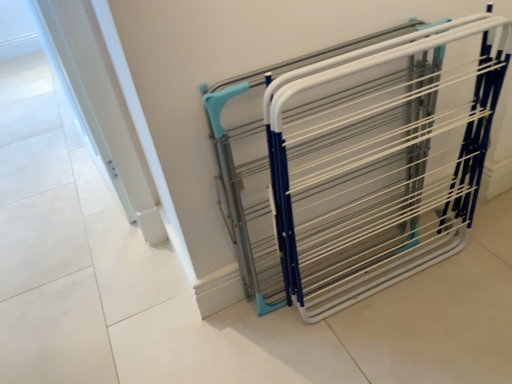
Where is `unoccupied region to the right of white metal gate at center`? unoccupied region to the right of white metal gate at center is located at coordinates (461, 277).